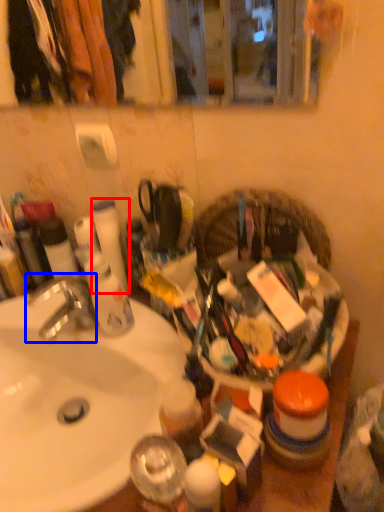
Question: Which point is closer to the camera, toilet paper (highlighted by a red box) or faucet (highlighted by a blue box)?

Choices:
 (A) toilet paper
 (B) faucet

Answer: (B)